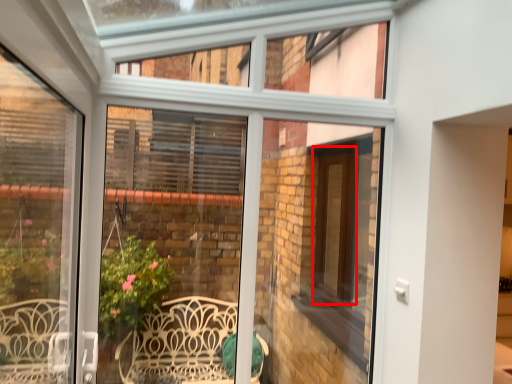
Question: Considering the relative positions of screen door (annotated by the red box) and window frame in the image provided, where is screen door (annotated by the red box) located with respect to the staircase?

Choices:
 (A) right
 (B) left

Answer: (A)